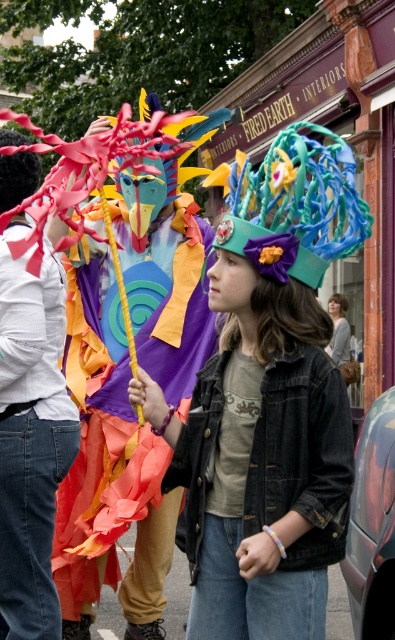
Looking at this image, can you confirm if matte green fabric hat at center is wider than matte black shirt at left?

No.

Which of these two, matte green fabric hat at center or matte black shirt at left, stands shorter?

With less height is matte green fabric hat at center.

This screenshot has width=395, height=640. Identify the location of matte green fabric hat at center. (261, 445).

Consider the image. Can you confirm if matte green fabric hat at center is positioned to the right of light brown hair at center?

Incorrect, matte green fabric hat at center is not on the right side of light brown hair at center.

Is matte green fabric hat at center taller than light brown hair at center?

In fact, matte green fabric hat at center may be shorter than light brown hair at center.

Who is more distant from viewer, (306, 394) or (344, 326)?

Positioned behind is point (344, 326).

What are the coordinates of `matte green fabric hat at center` in the screenshot? It's located at (261, 445).

Describe the element at coordinates (30, 438) in the screenshot. Image resolution: width=395 pixels, height=640 pixels. I see `matte black shirt at left` at that location.

Find the location of a particular element. matte black shirt at left is located at coordinates (30, 438).

Locate an element on the screen. The image size is (395, 640). matte black shirt at left is located at coordinates (30, 438).